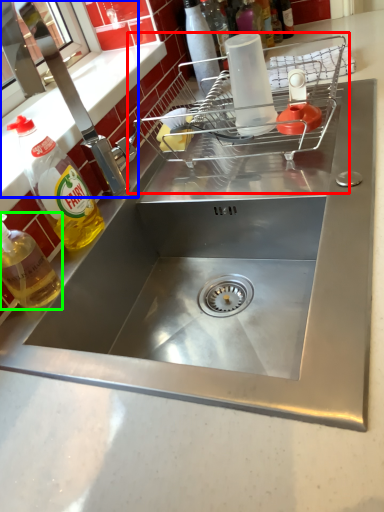
Question: Based on their relative distances, which object is nearer to appliance (highlighted by a red box)? Choose from tap (highlighted by a blue box) and bottle (highlighted by a green box).

Choices:
 (A) tap
 (B) bottle

Answer: (A)